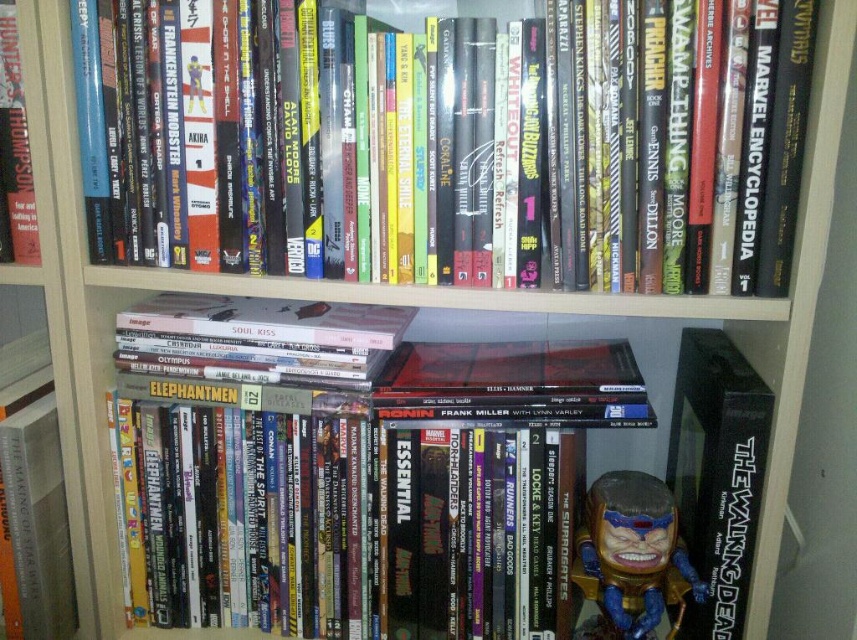
Question: From the image, what is the correct spatial relationship of hardcover books at upper center in relation to black matte book at center?

Choices:
 (A) above
 (B) below

Answer: (A)

Question: Can you confirm if black matte book at center is positioned above shiny metallic figure at center?

Choices:
 (A) no
 (B) yes

Answer: (B)

Question: Which point is closer to the camera?

Choices:
 (A) hardcover book at left
 (B) black matte book at center
 (C) hardcover books at upper center

Answer: (C)

Question: Which point is farther from the camera taking this photo?

Choices:
 (A) (739, 481)
 (B) (634, 531)
 (C) (16, 212)
 (D) (478, 38)

Answer: (C)

Question: Can you confirm if black matte book at center is thinner than shiny metallic figure at center?

Choices:
 (A) no
 (B) yes

Answer: (B)

Question: Which object is positioned farthest from the shiny metallic figure at center?

Choices:
 (A) hardcover books at upper center
 (B) black matte book at center
 (C) hardcover book at left

Answer: (C)